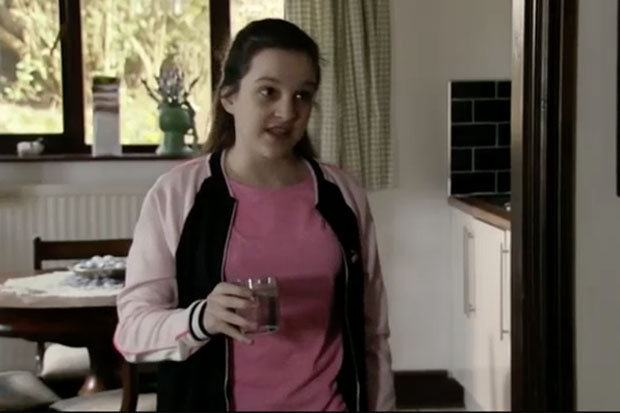
The width and height of the screenshot is (620, 413). In order to click on backsplash tile in this screenshot , I will do pyautogui.click(x=484, y=119).